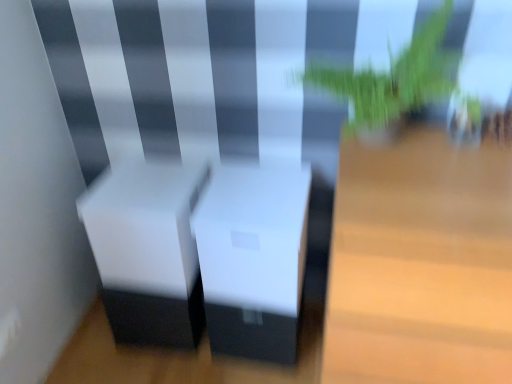
Where is `green leafy plant at upper right`? green leafy plant at upper right is located at coordinates (399, 79).

Is light wood table at center, which is the 1th table in right-to-left order, taller or shorter than green leafy plant at upper right?

In the image, light wood table at center, which is the 1th table in right-to-left order, appears to be taller than green leafy plant at upper right.

Is light wood table at center, which is the 1th table in right-to-left order, beside green leafy plant at upper right?

No, light wood table at center, which is the 1th table in right-to-left order, is not in contact with green leafy plant at upper right.

From a real-world perspective, is light wood table at center, which is the 1th table in right-to-left order, under green leafy plant at upper right?

Yes, from a real-world perspective, light wood table at center, which is the 1th table in right-to-left order, is under green leafy plant at upper right.

Which object is further away from the camera, white matte table at center, positioned as the second table in right-to-left order, or light wood table at center, which is the 1th table in right-to-left order?

white matte table at center, positioned as the second table in right-to-left order.

Based on the photo, can you confirm if white matte table at center, which is counted as the 1th table, starting from the left, is bigger than light wood table at center, positioned as the second table in left-to-right order?

No, white matte table at center, which is counted as the 1th table, starting from the left, is not bigger than light wood table at center, positioned as the second table in left-to-right order.

Consider the image. From a real-world perspective, is white matte table at center, positioned as the second table in right-to-left order, on light wood table at center, which is the 1th table in right-to-left order?

Yes, from a real-world perspective, white matte table at center, positioned as the second table in right-to-left order, is over light wood table at center, which is the 1th table in right-to-left order

Based on their sizes in the image, would you say green leafy plant at upper right is bigger or smaller than white matte table at center, which is counted as the 1th table, starting from the left?

Clearly, green leafy plant at upper right is larger in size than white matte table at center, which is counted as the 1th table, starting from the left.

How many degrees apart are the facing directions of green leafy plant at upper right and white matte table at center, positioned as the second table in right-to-left order?

There is a 0.227-degree angle between the facing directions of green leafy plant at upper right and white matte table at center, positioned as the second table in right-to-left order.

Is point (365, 96) closer to viewer compared to point (250, 210)?

Yes, it is in front of point (250, 210).

Is green leafy plant at upper right far away from white matte table at center, which is counted as the 1th table, starting from the left?

Actually, green leafy plant at upper right and white matte table at center, which is counted as the 1th table, starting from the left, are a little close together.

Is green leafy plant at upper right next to light wood table at center, which is the 1th table in right-to-left order?

No, green leafy plant at upper right is not in contact with light wood table at center, which is the 1th table in right-to-left order.

From the image's perspective, is green leafy plant at upper right under light wood table at center, positioned as the second table in left-to-right order?

Actually, green leafy plant at upper right appears above light wood table at center, positioned as the second table in left-to-right order, in the image.

In the image, is green leafy plant at upper right on the left side or the right side of light wood table at center, positioned as the second table in left-to-right order?

green leafy plant at upper right is to the left of light wood table at center, positioned as the second table in left-to-right order.

You are a GUI agent. You are given a task and a screenshot of the screen. Output one action in this format:
    pyautogui.click(x=<x>, y=<y>)
    Task: Click on the houseplant on the right of the white matte table at center, which is counted as the 1th table, starting from the left
    Image resolution: width=512 pixels, height=384 pixels.
    Given the screenshot: What is the action you would take?
    pyautogui.click(x=399, y=79)

Is the depth of white matte table at center, positioned as the second table in right-to-left order, less than that of green leafy plant at upper right?

No, it is behind green leafy plant at upper right.

From a real-world perspective, between white matte table at center, positioned as the second table in right-to-left order, and green leafy plant at upper right, who is vertically lower?

In real-world perspective, white matte table at center, positioned as the second table in right-to-left order, is lower.

Is white matte table at center, which is counted as the 1th table, starting from the left, wider than green leafy plant at upper right?

Yes, white matte table at center, which is counted as the 1th table, starting from the left, is wider than green leafy plant at upper right.

From a real-world perspective, is light wood table at center, which is the 1th table in right-to-left order, physically below white matte table at center, positioned as the second table in right-to-left order?

Yes, from a real-world perspective, light wood table at center, which is the 1th table in right-to-left order, is beneath white matte table at center, positioned as the second table in right-to-left order.

Who is smaller, light wood table at center, positioned as the second table in left-to-right order, or white matte table at center, positioned as the second table in right-to-left order?

Smaller between the two is white matte table at center, positioned as the second table in right-to-left order.

From the image's perspective, which one is positioned lower, light wood table at center, which is the 1th table in right-to-left order, or white matte table at center, which is counted as the 1th table, starting from the left?

From the image's view, light wood table at center, which is the 1th table in right-to-left order, is below.

This screenshot has width=512, height=384. I want to click on table lying on the right of green leafy plant at upper right, so click(x=421, y=264).

Locate an element on the screen. table located in front of the white matte table at center, positioned as the second table in right-to-left order is located at coordinates (421, 264).

Estimate the real-world distances between objects in this image. Which object is closer to white matte table at center, positioned as the second table in right-to-left order, green leafy plant at upper right or light wood table at center, which is the 1th table in right-to-left order?

Based on the image, light wood table at center, which is the 1th table in right-to-left order, appears to be nearer to white matte table at center, positioned as the second table in right-to-left order.

Considering their positions, is white matte table at center, which is counted as the 1th table, starting from the left, positioned further to green leafy plant at upper right than light wood table at center, positioned as the second table in left-to-right order?

Based on the image, white matte table at center, which is counted as the 1th table, starting from the left, appears to be further to green leafy plant at upper right.

From the image, which object appears to be nearer to white matte table at center, positioned as the second table in right-to-left order, light wood table at center, which is the 1th table in right-to-left order, or green leafy plant at upper right?

Among the two, light wood table at center, which is the 1th table in right-to-left order, is located nearer to white matte table at center, positioned as the second table in right-to-left order.

Which object lies nearer to the anchor point light wood table at center, positioned as the second table in left-to-right order, green leafy plant at upper right or white matte table at center, which is counted as the 1th table, starting from the left?

The object closer to light wood table at center, positioned as the second table in left-to-right order, is green leafy plant at upper right.

When comparing their distances from light wood table at center, which is the 1th table in right-to-left order, does white matte table at center, which is counted as the 1th table, starting from the left, or green leafy plant at upper right seem closer?

green leafy plant at upper right lies closer to light wood table at center, which is the 1th table in right-to-left order, than the other object.

From the image, which object appears to be farther from green leafy plant at upper right, light wood table at center, positioned as the second table in left-to-right order, or white matte table at center, positioned as the second table in right-to-left order?

white matte table at center, positioned as the second table in right-to-left order.

This screenshot has width=512, height=384. In order to click on table between green leafy plant at upper right and light wood table at center, which is the 1th table in right-to-left order, vertically in this screenshot , I will do `click(253, 259)`.